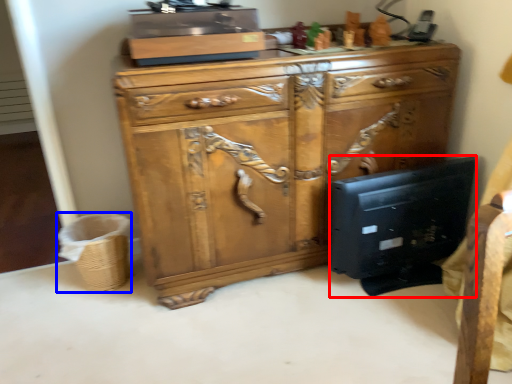
Question: Which point is further to the camera, desktop computer (highlighted by a red box) or basket (highlighted by a blue box)?

Choices:
 (A) desktop computer
 (B) basket

Answer: (B)